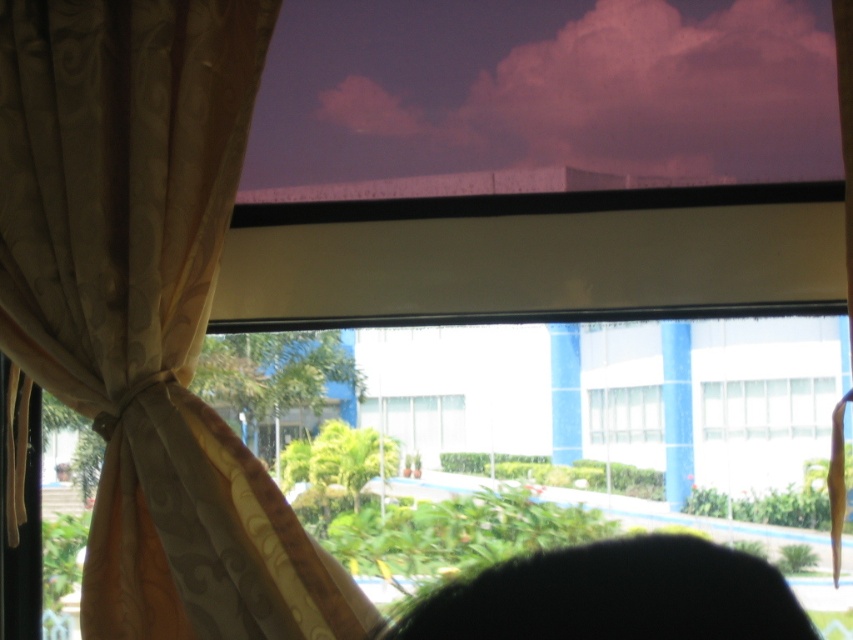
Is point (165, 560) positioned before point (595, 36)?

Yes.

Does silky beige curtain at left appear on the left side of purple fabric blind at upper center?

Yes, silky beige curtain at left is to the left of purple fabric blind at upper center.

What do you see at coordinates (148, 308) in the screenshot?
I see `silky beige curtain at left` at bounding box center [148, 308].

You are a GUI agent. You are given a task and a screenshot of the screen. Output one action in this format:
    pyautogui.click(x=<x>, y=<y>)
    Task: Click on the silky beige curtain at left
    Image resolution: width=853 pixels, height=640 pixels.
    Given the screenshot: What is the action you would take?
    tap(148, 308)

Which is below, black hair at lower center or white glass window at center?

white glass window at center is below.

Does black hair at lower center have a larger size compared to white glass window at center?

Yes.

In order to click on black hair at lower center in this screenshot , I will do `click(614, 595)`.

Does silky beige curtain at left have a smaller size compared to transparent glass window at center?

Actually, silky beige curtain at left might be larger than transparent glass window at center.

Can you confirm if silky beige curtain at left is positioned to the left of transparent glass window at center?

Yes, silky beige curtain at left is to the left of transparent glass window at center.

The height and width of the screenshot is (640, 853). Describe the element at coordinates (148, 308) in the screenshot. I see `silky beige curtain at left` at that location.

In order to click on silky beige curtain at left in this screenshot , I will do `click(148, 308)`.